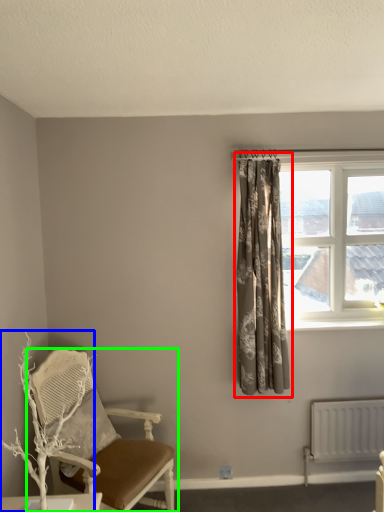
Question: Which is nearer to the curtain (highlighted by a red box)? branch (highlighted by a blue box) or chair (highlighted by a green box).

Choices:
 (A) branch
 (B) chair

Answer: (B)